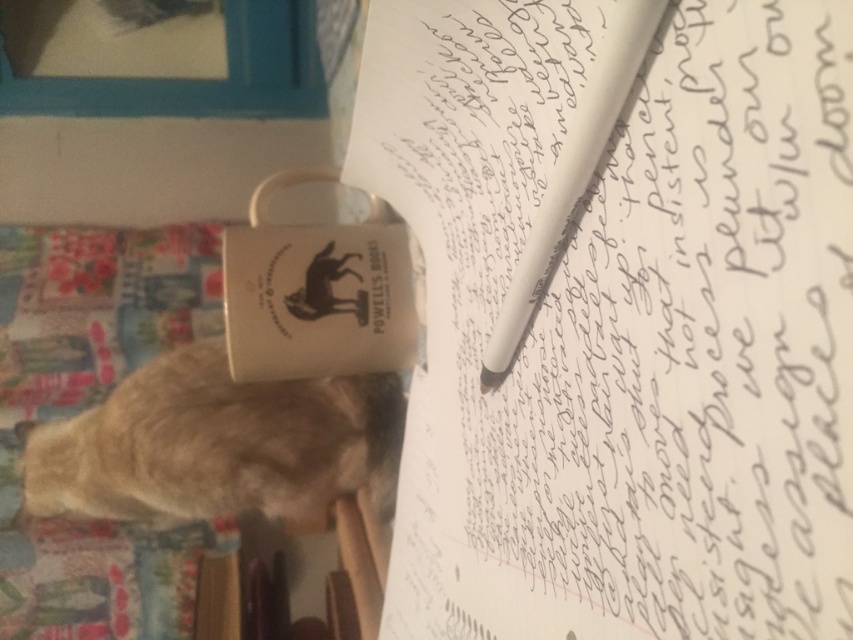
Who is more distant from viewer, (831,205) or (567,186)?

Positioned behind is point (567,186).

I want to click on white paper at upper center, so click(619, 316).

Between point (805, 500) and point (646, 32), which one is positioned in front?

Point (805, 500) is more forward.

The image size is (853, 640). Identify the location of white paper at upper center. (619, 316).

In the scene shown: Is white paper at upper center positioned before white matte paper cup at center?

That is True.

Can you confirm if white paper at upper center is bigger than white matte paper cup at center?

Yes, white paper at upper center is bigger than white matte paper cup at center.

The height and width of the screenshot is (640, 853). Identify the location of white paper at upper center. (619, 316).

Looking at this image, can you confirm if white matte paper cup at center is positioned to the left of white matte pen at center?

Yes, white matte paper cup at center is to the left of white matte pen at center.

What do you see at coordinates (316, 292) in the screenshot? The image size is (853, 640). I see `white matte paper cup at center` at bounding box center [316, 292].

Find the location of a particular element. white matte paper cup at center is located at coordinates (316, 292).